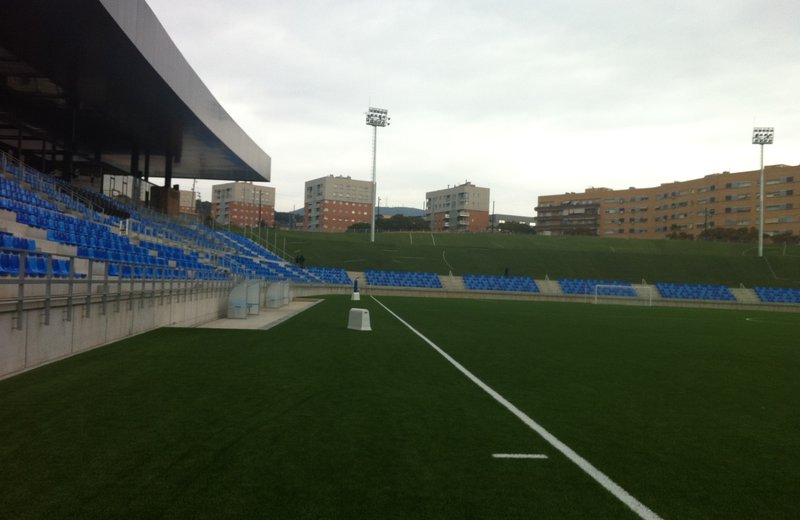
At what (x,y) coordinates should I click in order to perform the action: click on stairs. Please return your answer as a coordinate pair (x, y). The width and height of the screenshot is (800, 520). Looking at the image, I should click on (64, 248).